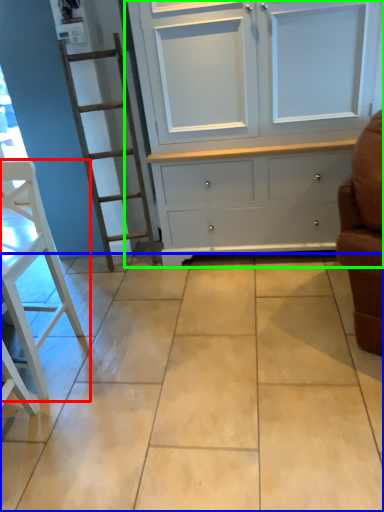
Question: Which object is positioned farthest from furniture (highlighted by a red box)? Select from ceramic tile (highlighted by a blue box) and cupboard (highlighted by a green box).

Choices:
 (A) ceramic tile
 (B) cupboard

Answer: (B)